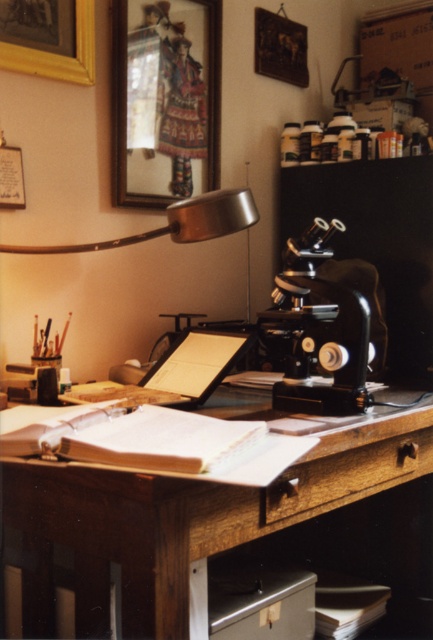
Question: Can you confirm if wooden framed picture at upper left is bigger than black metal microscope at center?

Choices:
 (A) yes
 (B) no

Answer: (A)

Question: Among these points, which one is nearest to the camera?

Choices:
 (A) pyautogui.click(x=144, y=540)
 (B) pyautogui.click(x=361, y=364)
 (C) pyautogui.click(x=151, y=134)
 (D) pyautogui.click(x=71, y=80)

Answer: (A)

Question: Considering the real-world distances, which object is farthest from the wooden framed picture at upper left?

Choices:
 (A) black metal microscope at center
 (B) brown wooden table at center

Answer: (B)

Question: From the image, what is the correct spatial relationship of brown wooden table at center in relation to gold wooden picture frame at upper left?

Choices:
 (A) above
 (B) below

Answer: (B)

Question: Where is black metal microscope at center located in relation to gold wooden picture frame at upper left in the image?

Choices:
 (A) left
 (B) right

Answer: (B)

Question: Which object appears farthest from the camera in this image?

Choices:
 (A) brown wooden table at center
 (B) black metal microscope at center
 (C) wooden framed picture at upper left
 (D) gold wooden picture frame at upper left

Answer: (C)